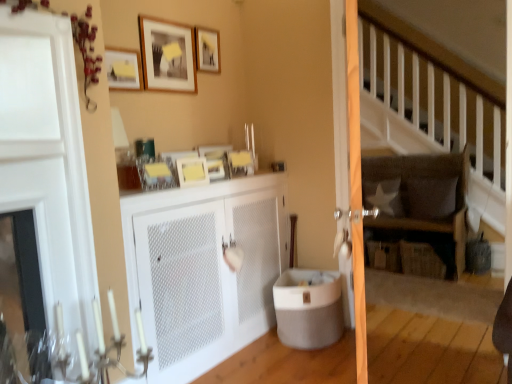
What do you see at coordinates (431, 197) in the screenshot? The height and width of the screenshot is (384, 512). I see `brown textured pillow at upper right, placed as the 1th pillow when sorted from right to left` at bounding box center [431, 197].

This screenshot has width=512, height=384. Describe the element at coordinates (207, 50) in the screenshot. I see `matte wooden picture frame at upper center, the 4th picture frame in the bottom-to-top sequence` at that location.

Image resolution: width=512 pixels, height=384 pixels. In order to click on dark brown fabric rocking chair at upper right in this screenshot , I will do `click(421, 206)`.

Describe the element at coordinates (48, 160) in the screenshot. I see `white glossy door at left` at that location.

Where is `matte white picture frame at upper center, which is the 3th picture frame in bottom-to-top order`? matte white picture frame at upper center, which is the 3th picture frame in bottom-to-top order is located at coordinates (167, 55).

From the picture: From a real-world perspective, which is physically below, brown textured pillow at upper right, the second pillow in the left-to-right sequence, or matte yellow picture frame at upper left, placed as the 3th picture frame when sorted from top to bottom?

From a 3D spatial view, brown textured pillow at upper right, the second pillow in the left-to-right sequence, is below.

How much distance is there between brown textured pillow at upper right, the second pillow in the left-to-right sequence, and matte yellow picture frame at upper left, the 2th picture frame in the bottom-to-top sequence?

8.54 feet.

This screenshot has width=512, height=384. I want to click on the 4th picture frame in front of the brown textured pillow at upper right, placed as the 1th pillow when sorted from right to left, counting from the anchor's position, so click(123, 69).

Is brown textured pillow at upper right, placed as the 1th pillow when sorted from right to left, inside the boundaries of matte yellow picture frame at upper left, placed as the 3th picture frame when sorted from top to bottom, or outside?

brown textured pillow at upper right, placed as the 1th pillow when sorted from right to left, cannot be found inside matte yellow picture frame at upper left, placed as the 3th picture frame when sorted from top to bottom.

Is matte white picture frame at upper center, which is the 3th picture frame in bottom-to-top order, not close to white glossy door at left?

Actually, matte white picture frame at upper center, which is the 3th picture frame in bottom-to-top order, and white glossy door at left are a little close together.

How many degrees apart are the facing directions of matte white picture frame at upper center, which is the 3th picture frame in bottom-to-top order, and white glossy door at left?

The facing directions of matte white picture frame at upper center, which is the 3th picture frame in bottom-to-top order, and white glossy door at left are 0.161 degrees apart.

Is matte white picture frame at upper center, which is the 3th picture frame in bottom-to-top order, situated inside white glossy door at left or outside?

matte white picture frame at upper center, which is the 3th picture frame in bottom-to-top order, is located beyond the bounds of white glossy door at left.

Is matte white picture frame at upper center, acting as the 2th picture frame starting from the top, positioned before white glossy door at left?

No, matte white picture frame at upper center, acting as the 2th picture frame starting from the top, is further to the viewer.

Considering the relative positions of matte gray tub at lower center and matte yellow picture frame at upper left, the 2th picture frame in the bottom-to-top sequence, in the image provided, is matte gray tub at lower center in front of matte yellow picture frame at upper left, the 2th picture frame in the bottom-to-top sequence,?

No, matte gray tub at lower center is further to the viewer.

How far apart are matte gray tub at lower center and matte yellow picture frame at upper left, placed as the 3th picture frame when sorted from top to bottom?

The distance of matte gray tub at lower center from matte yellow picture frame at upper left, placed as the 3th picture frame when sorted from top to bottom, is 5.00 feet.

Considering the sizes of objects matte gray tub at lower center and matte yellow picture frame at upper left, placed as the 3th picture frame when sorted from top to bottom, in the image provided, who is smaller, matte gray tub at lower center or matte yellow picture frame at upper left, placed as the 3th picture frame when sorted from top to bottom,?

Smaller between the two is matte yellow picture frame at upper left, placed as the 3th picture frame when sorted from top to bottom.

Can you confirm if matte white screen door at center is wider than brown textured pillow at upper right, placed as the 1th pillow when sorted from right to left?

Yes.

Is matte white screen door at center oriented away from brown textured pillow at upper right, the second pillow in the left-to-right sequence?

No, matte white screen door at center's orientation is not away from brown textured pillow at upper right, the second pillow in the left-to-right sequence.

Is matte white screen door at center placed right next to brown textured pillow at upper right, the second pillow in the left-to-right sequence?

No, matte white screen door at center is not making contact with brown textured pillow at upper right, the second pillow in the left-to-right sequence.

Measure the distance from matte white screen door at center to brown textured pillow at upper right, placed as the 1th pillow when sorted from right to left.

A distance of 6.45 feet exists between matte white screen door at center and brown textured pillow at upper right, placed as the 1th pillow when sorted from right to left.

From their relative heights in the image, would you say white fabric pillow at center-right, acting as the second pillow starting from the right, is taller or shorter than matte white screen door at center?

Considering their sizes, white fabric pillow at center-right, acting as the second pillow starting from the right, has less height than matte white screen door at center.

Which of these two, white fabric pillow at center-right, acting as the second pillow starting from the right, or matte white screen door at center, is bigger?

matte white screen door at center is bigger.

From a real-world perspective, which object stands above the other?

matte white screen door at center, from a real-world perspective.

Based on the photo, does white fabric pillow at center-right, which ranks as the first pillow in left-to-right order, come in front of matte white screen door at center?

No, white fabric pillow at center-right, which ranks as the first pillow in left-to-right order, is further to the viewer.

Is white fabric pillow at center-right, acting as the second pillow starting from the right, bigger than matte yellow picture frame at upper center, arranged as the first picture frame when ordered from the bottom?

Indeed, white fabric pillow at center-right, acting as the second pillow starting from the right, has a larger size compared to matte yellow picture frame at upper center, arranged as the first picture frame when ordered from the bottom.

The width and height of the screenshot is (512, 384). There is a white fabric pillow at center-right, which ranks as the first pillow in left-to-right order. In order to click on the 1st picture frame above it (from the image's perspective) in this screenshot , I will do `click(192, 171)`.

Is point (388, 197) positioned before point (189, 163)?

That is False.

Is white fabric pillow at center-right, which ranks as the first pillow in left-to-right order, touching matte yellow picture frame at upper center, arranged as the first picture frame when ordered from the bottom?

No, white fabric pillow at center-right, which ranks as the first pillow in left-to-right order, is not beside matte yellow picture frame at upper center, arranged as the first picture frame when ordered from the bottom.

Which object is further away from the camera taking this photo, white glossy door at left or white mesh cabinet at center?

white mesh cabinet at center is behind.

How different are the orientations of white glossy door at left and white mesh cabinet at center in degrees?

The angle between the facing direction of white glossy door at left and the facing direction of white mesh cabinet at center is 0.905 degrees.

Who is taller, white glossy door at left or white mesh cabinet at center?

With more height is white glossy door at left.

This screenshot has width=512, height=384. Find the location of `door in front of the white mesh cabinet at center`. door in front of the white mesh cabinet at center is located at coordinates (48, 160).

Image resolution: width=512 pixels, height=384 pixels. Identify the location of picture frame that is the 2nd one when counting upward from the brown textured pillow at upper right, the second pillow in the left-to-right sequence (from the image's perspective). (123, 69).

This screenshot has height=384, width=512. I want to click on picture frame that is the 3rd one above the white glossy door at left (from a real-world perspective), so click(x=167, y=55).

Based on their spatial positions, is brown textured pillow at upper right, the second pillow in the left-to-right sequence, or matte white screen door at center further from matte white picture frame at upper center, which is the 3th picture frame in bottom-to-top order?

Based on the image, brown textured pillow at upper right, the second pillow in the left-to-right sequence, appears to be further to matte white picture frame at upper center, which is the 3th picture frame in bottom-to-top order.

Considering their positions, is dark brown fabric rocking chair at upper right positioned further to brown textured pillow at upper right, placed as the 1th pillow when sorted from right to left, than matte wooden picture frame at upper center, the first picture frame in the top-to-bottom sequence?

Among the two, matte wooden picture frame at upper center, the first picture frame in the top-to-bottom sequence, is located further to brown textured pillow at upper right, placed as the 1th pillow when sorted from right to left.

Looking at the image, which one is located closer to white mesh cabinet at center, white fabric pillow at center-right, acting as the second pillow starting from the right, or dark brown fabric rocking chair at upper right?

dark brown fabric rocking chair at upper right is positioned closer to the anchor white mesh cabinet at center.

Estimate the real-world distances between objects in this image. Which object is closer to white fabric pillow at center-right, acting as the second pillow starting from the right, white mesh cabinet at center or white glossy door at left?

The object closer to white fabric pillow at center-right, acting as the second pillow starting from the right, is white mesh cabinet at center.

Based on their spatial positions, is white fabric pillow at center-right, acting as the second pillow starting from the right, or matte yellow picture frame at upper left, placed as the 3th picture frame when sorted from top to bottom, closer to matte white screen door at center?

matte yellow picture frame at upper left, placed as the 3th picture frame when sorted from top to bottom, lies closer to matte white screen door at center than the other object.

From the image, which object appears to be nearer to matte gray tub at lower center, matte yellow picture frame at upper left, the 2th picture frame in the bottom-to-top sequence, or white mesh cabinet at center?

The object closer to matte gray tub at lower center is white mesh cabinet at center.

When comparing their distances from matte wooden picture frame at upper center, the first picture frame in the top-to-bottom sequence, does matte white screen door at center or dark brown fabric rocking chair at upper right seem further?

Among the two, dark brown fabric rocking chair at upper right is located further to matte wooden picture frame at upper center, the first picture frame in the top-to-bottom sequence.

Based on their spatial positions, is matte white picture frame at upper center, which is the 3th picture frame in bottom-to-top order, or matte yellow picture frame at upper center, positioned as the fourth picture frame in top-to-bottom order, closer to matte wooden picture frame at upper center, the 4th picture frame in the bottom-to-top sequence?

The object closer to matte wooden picture frame at upper center, the 4th picture frame in the bottom-to-top sequence, is matte white picture frame at upper center, which is the 3th picture frame in bottom-to-top order.

Image resolution: width=512 pixels, height=384 pixels. I want to click on picture frame located between white glossy door at left and matte yellow picture frame at upper center, positioned as the fourth picture frame in top-to-bottom order, in the depth direction, so click(123, 69).

The width and height of the screenshot is (512, 384). I want to click on cabinetry located between matte yellow picture frame at upper left, placed as the 3th picture frame when sorted from top to bottom, and matte white screen door at center in the left-right direction, so click(x=204, y=269).

Image resolution: width=512 pixels, height=384 pixels. I want to click on cabinetry located between matte yellow picture frame at upper center, positioned as the fourth picture frame in top-to-bottom order, and matte white screen door at center in the left-right direction, so click(x=204, y=269).

Locate an element on the screen. bath situated between matte wooden picture frame at upper center, the first picture frame in the top-to-bottom sequence, and brown textured pillow at upper right, the second pillow in the left-to-right sequence, from left to right is located at coordinates (308, 308).